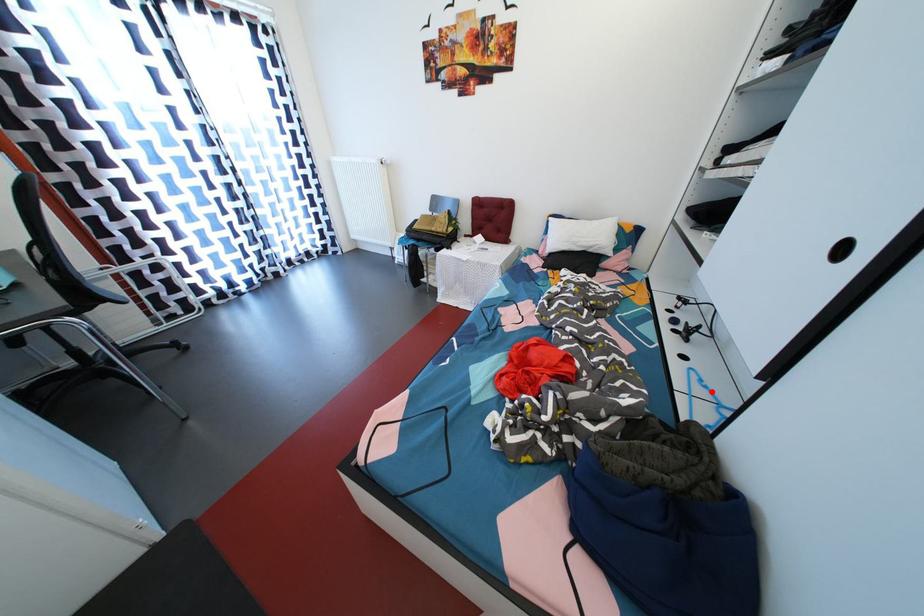
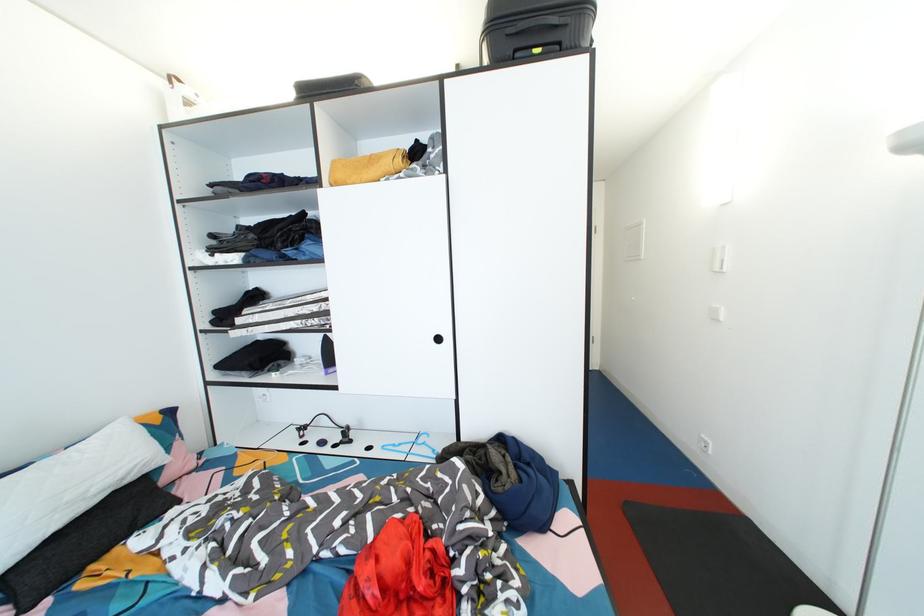
Locate, in the second image, the point that corresponds to the highlighted location in the first image.

(407, 450)